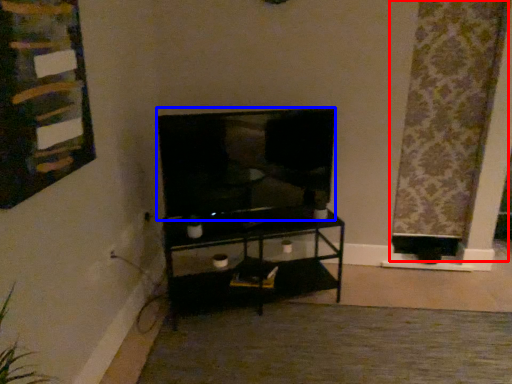
Question: Which point is further to the camera, curtain (highlighted by a red box) or television (highlighted by a blue box)?

Choices:
 (A) curtain
 (B) television

Answer: (A)